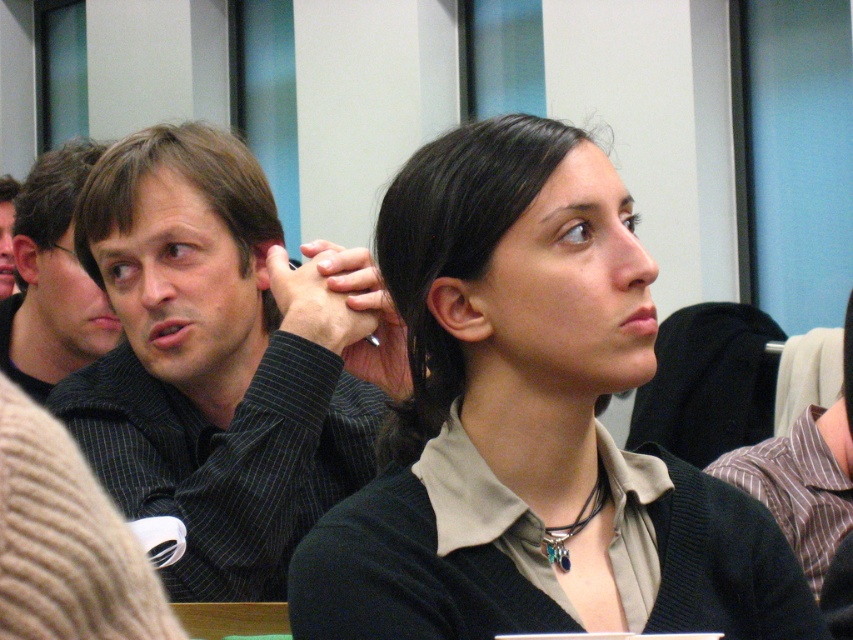
You are a photographer trying to capture the person wearing the matte black sweater at center in the image. The camera you are using has a focus point at coordinates point [531,426]. Will the focus point align with the matte black sweater at center?

Yes, the matte black sweater at center is located at point [531,426], so the focus point will align with the matte black sweater at center.